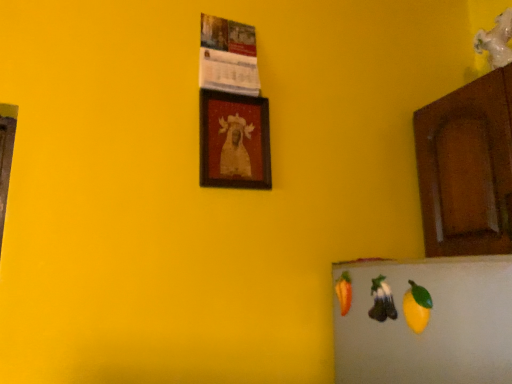
Question: Is brown wood cabinet at right touching shiny purple grapes at lower right, which is the 1th fruit from back to front?

Choices:
 (A) yes
 (B) no

Answer: (B)

Question: Does brown wood cabinet at right have a smaller size compared to shiny purple grapes at lower right, the second fruit from the front?

Choices:
 (A) no
 (B) yes

Answer: (A)

Question: Is brown wood cabinet at right far from shiny purple grapes at lower right, which is the 1th fruit from back to front?

Choices:
 (A) yes
 (B) no

Answer: (B)

Question: Is the depth of brown wood cabinet at right less than that of shiny purple grapes at lower right, the second fruit from the front?

Choices:
 (A) yes
 (B) no

Answer: (B)

Question: Is shiny purple grapes at lower right, which is the 1th fruit from back to front, a part of brown wood cabinet at right?

Choices:
 (A) no
 (B) yes

Answer: (A)

Question: From their relative heights in the image, would you say wooden framed portrait at center is taller or shorter than shiny purple grapes at lower right, the second fruit from the front?

Choices:
 (A) tall
 (B) short

Answer: (A)

Question: Is point (241, 130) positioned closer to the camera than point (375, 289)?

Choices:
 (A) closer
 (B) farther

Answer: (B)

Question: Is wooden framed portrait at center situated inside shiny purple grapes at lower right, which is the 1th fruit from back to front, or outside?

Choices:
 (A) outside
 (B) inside

Answer: (A)

Question: Based on their sizes in the image, would you say wooden framed portrait at center is bigger or smaller than shiny purple grapes at lower right, the second fruit from the front?

Choices:
 (A) small
 (B) big

Answer: (B)

Question: From the image's perspective, is brown wood cabinet at right located above or below wooden framed portrait at center?

Choices:
 (A) above
 (B) below

Answer: (B)

Question: Is brown wood cabinet at right wider or thinner than wooden framed portrait at center?

Choices:
 (A) wide
 (B) thin

Answer: (A)

Question: In terms of height, does brown wood cabinet at right look taller or shorter compared to wooden framed portrait at center?

Choices:
 (A) short
 (B) tall

Answer: (B)

Question: Is brown wood cabinet at right spatially inside wooden framed portrait at center, or outside of it?

Choices:
 (A) outside
 (B) inside

Answer: (A)

Question: Does point (234, 115) appear closer or farther from the camera than point (413, 307)?

Choices:
 (A) farther
 (B) closer

Answer: (A)

Question: From a real-world perspective, is wooden framed portrait at center above or below yellow matte fruit at lower right, which is counted as the first fruit, starting from the front?

Choices:
 (A) above
 (B) below

Answer: (A)